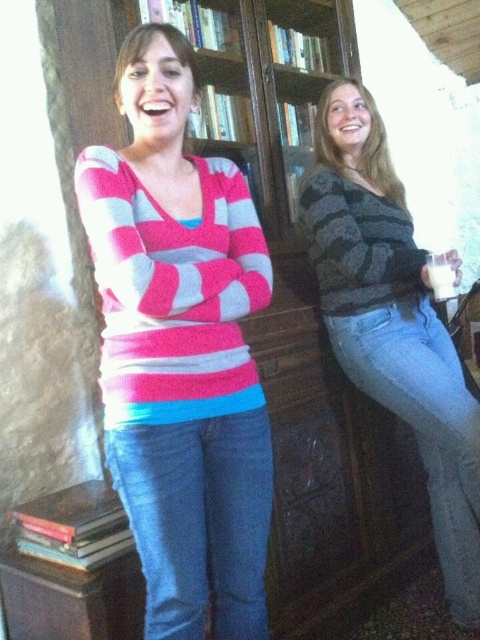
Question: Among these objects, which one is nearest to the camera?

Choices:
 (A) pink striped sweater at center
 (B) striped sweater at center

Answer: (A)

Question: Which object appears closest to the camera in this image?

Choices:
 (A) striped sweater at center
 (B) pink striped sweater at center

Answer: (B)

Question: Is pink striped sweater at center smaller than striped sweater at center?

Choices:
 (A) no
 (B) yes

Answer: (B)

Question: Does pink striped sweater at center come in front of striped sweater at center?

Choices:
 (A) yes
 (B) no

Answer: (A)

Question: Does pink striped sweater at center appear under striped sweater at center?

Choices:
 (A) yes
 (B) no

Answer: (B)

Question: Which of the following is the closest to the observer?

Choices:
 (A) pink striped sweater at center
 (B) striped sweater at center

Answer: (A)